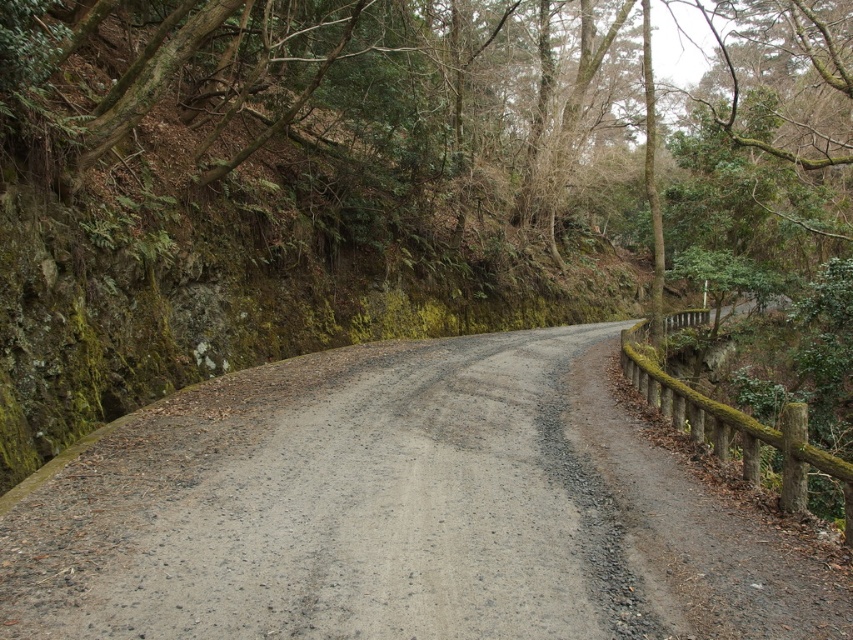
From the picture: You are standing at a point on the winding gravel road and want to walk towards the point that is closer to you. Which point should you head towards, point (846,230) or point (666,515)?

You should head towards point (666,515) because point (846,230) is further away from you than point (666,515).

You are standing at the center of the winding gravel road and see the point marked as point (x=410, y=148). Based on the scene description, what object does this point most likely correspond to?

The point (x=410, y=148) most likely corresponds to the green mossy rock at upper left as described in the scene.